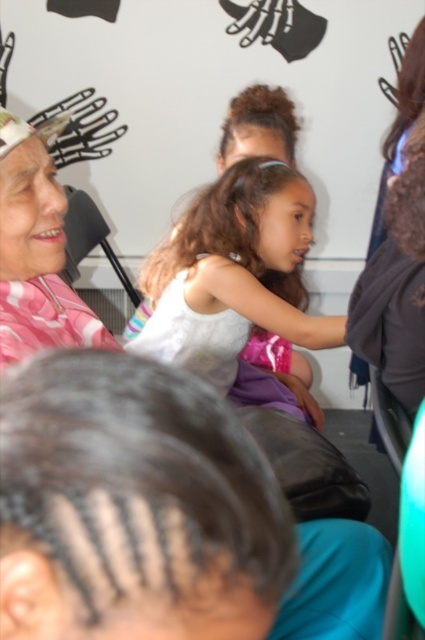
Question: Does white satin dress at center have a larger size compared to pink plaid shirt at upper left?

Choices:
 (A) no
 (B) yes

Answer: (B)

Question: Which object appears closest to the camera in this image?

Choices:
 (A) pink plaid shirt at upper left
 (B) white satin dress at center

Answer: (A)

Question: Among these objects, which one is nearest to the camera?

Choices:
 (A) pink plaid shirt at upper left
 (B) white satin dress at center

Answer: (A)

Question: Does white satin dress at center come in front of pink plaid shirt at upper left?

Choices:
 (A) no
 (B) yes

Answer: (A)

Question: Is white satin dress at center to the right of pink plaid shirt at upper left from the viewer's perspective?

Choices:
 (A) yes
 (B) no

Answer: (A)

Question: Among these objects, which one is nearest to the camera?

Choices:
 (A) pink plaid shirt at upper left
 (B) white satin dress at center

Answer: (A)